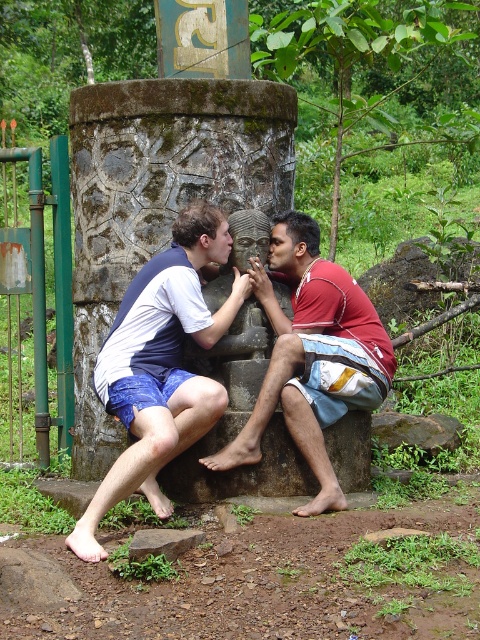
You are a photographer trying to capture a candid shot of the blue denim shorts at left and the brown rough rock at lower center. Since you want both subjects to be in focus, you need to know their height difference. Which object is taller?

The blue denim shorts at left is much taller than the brown rough rock at lower center.

You are a photographer standing in front of the scene. You want to take a photo that includes both the blue denim shorts at left and the brown rough rock at lower center. Which object should be placed closer to the camera to ensure both are in focus?

To ensure both the blue denim shorts at left and the brown rough rock at lower center are in focus, the brown rough rock at lower center should be placed closer to the camera since it is behind the blue denim shorts at left, allowing for a greater depth of field.